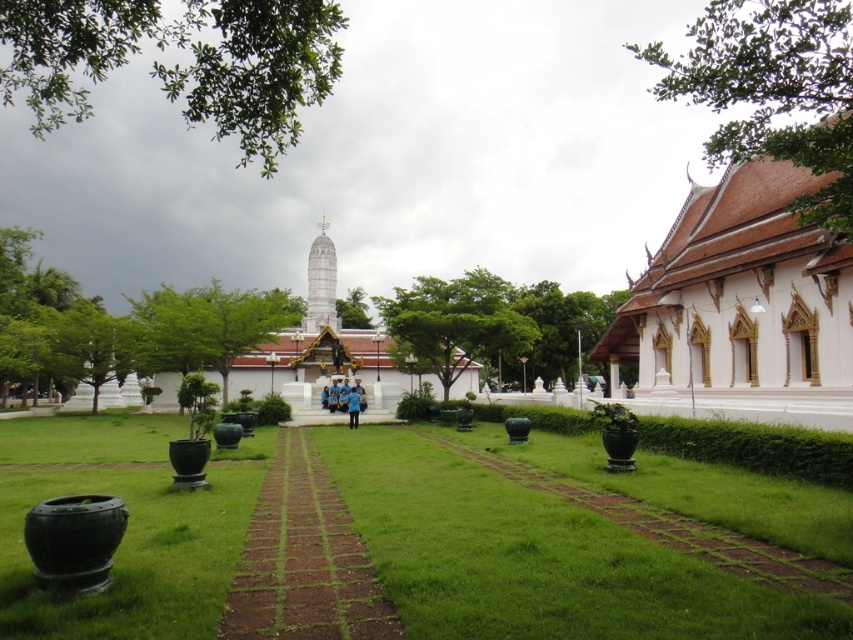
Can you confirm if green matte planter at center is positioned below green brick path at center?

Yes.

Who is more distant from viewer, (500, 573) or (358, 573)?

The point (358, 573) is behind.

The width and height of the screenshot is (853, 640). Identify the location of green matte planter at center. (532, 556).

Which is behind, point (100, 429) or point (387, 378)?

Positioned behind is point (387, 378).

Which is below, green matte planter at center or white smooth stupa at center?

green matte planter at center is below.

Looking at this image, who is more distant from viewer, [204,586] or [143,312]?

Positioned behind is point [143,312].

I want to click on green matte planter at center, so pyautogui.click(x=532, y=556).

Is green brick path at center further to the viewer compared to white smooth stupa at center?

No, it is in front of white smooth stupa at center.

Is point (331, 568) closer to viewer compared to point (204, 349)?

Yes, point (331, 568) is closer to viewer.

At what (x,y) coordinates should I click in order to perform the action: click on green brick path at center. Please return your answer as a coordinate pair (x, y). Looking at the image, I should click on (303, 561).

Where is `green brick path at center`? Image resolution: width=853 pixels, height=640 pixels. green brick path at center is located at coordinates (303, 561).